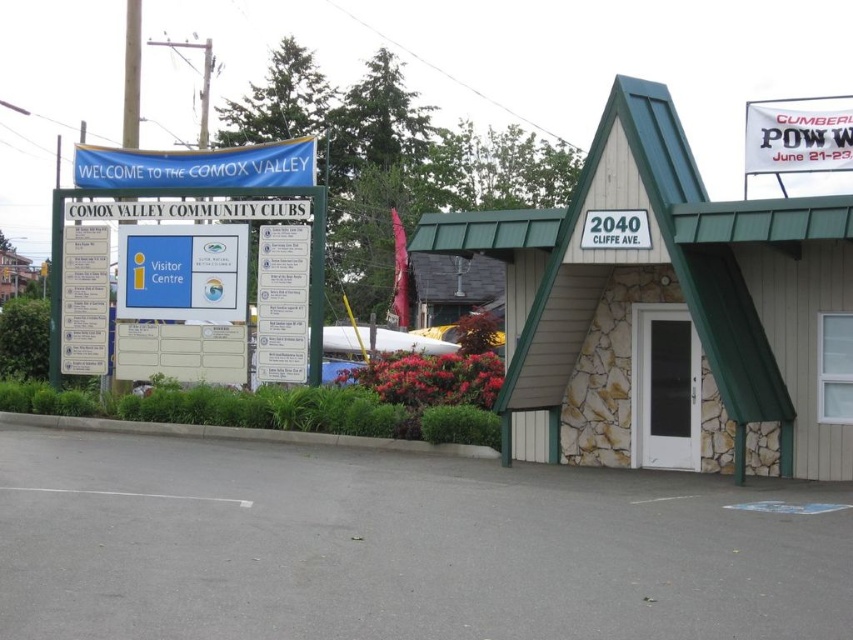
Can you confirm if white paper sign at left is positioned below white plastic sign at center?

Yes, white paper sign at left is below white plastic sign at center.

Does white paper sign at left come in front of white plastic sign at center?

No.

Is point (77, 230) farther from camera compared to point (616, 220)?

Yes, point (77, 230) is farther from viewer.

Identify the location of white paper sign at left. (84, 300).

Does beige siding motel at center have a lesser width compared to blue fabric banner at upper left?

Correct, beige siding motel at center's width is less than blue fabric banner at upper left's.

Image resolution: width=853 pixels, height=640 pixels. Describe the element at coordinates (671, 314) in the screenshot. I see `beige siding motel at center` at that location.

What are the coordinates of `beige siding motel at center` in the screenshot? It's located at (671, 314).

Which is below, blue fabric banner at upper left or white plastic sign at center?

white plastic sign at center is lower down.

Which is more to the left, blue fabric banner at upper left or white plastic sign at center?

From the viewer's perspective, blue fabric banner at upper left appears more on the left side.

What do you see at coordinates (196, 166) in the screenshot? This screenshot has width=853, height=640. I see `blue fabric banner at upper left` at bounding box center [196, 166].

Image resolution: width=853 pixels, height=640 pixels. Identify the location of blue fabric banner at upper left. (196, 166).